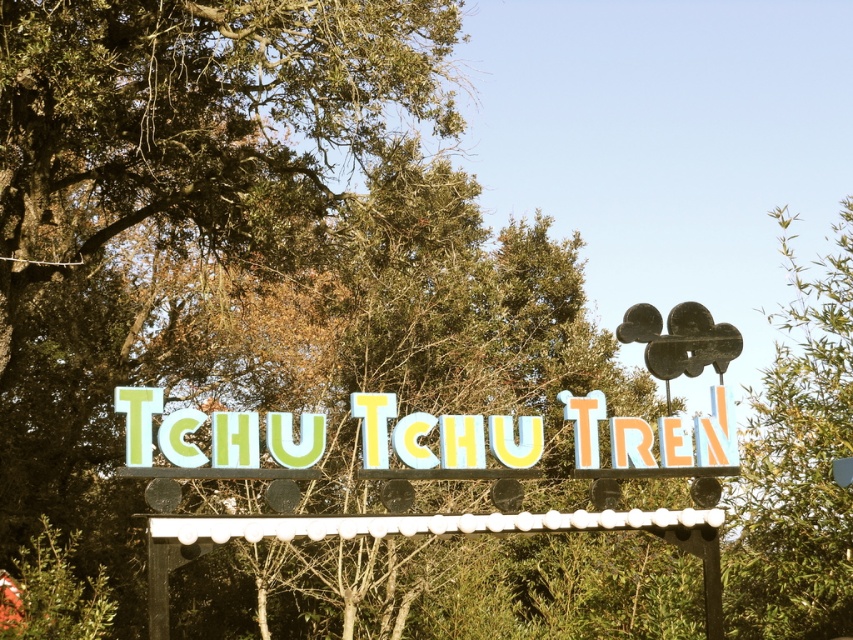
Question: Is green leafy tree at upper right closer to the viewer compared to pastel painted letters at center?

Choices:
 (A) yes
 (B) no

Answer: (B)

Question: Is green leafy tree at upper right positioned in front of pastel painted letters at center?

Choices:
 (A) no
 (B) yes

Answer: (A)

Question: Which object appears farthest from the camera in this image?

Choices:
 (A) green leafy tree at upper right
 (B) pastel painted letters at center

Answer: (A)

Question: Does green leafy tree at upper right appear on the left side of pastel painted letters at center?

Choices:
 (A) yes
 (B) no

Answer: (B)